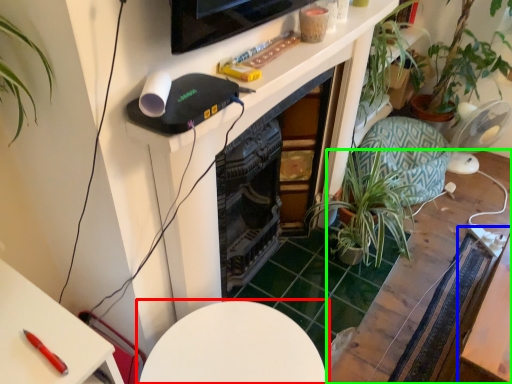
Question: Estimate the real-world distances between objects in this image. Which object is closer to table (highlighted by a red box), table (highlighted by a blue box) or table (highlighted by a green box)?

Choices:
 (A) table
 (B) table

Answer: (A)